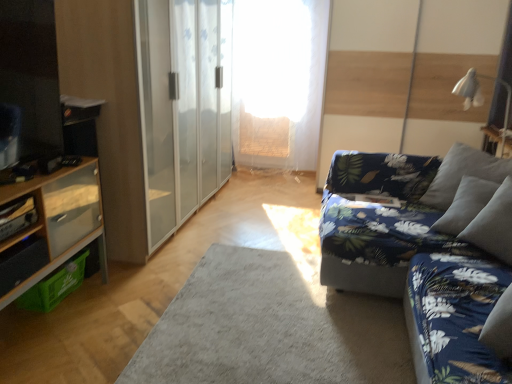
In order to click on free point to the right of transparent glass barn door at center in this screenshot , I will do `click(270, 195)`.